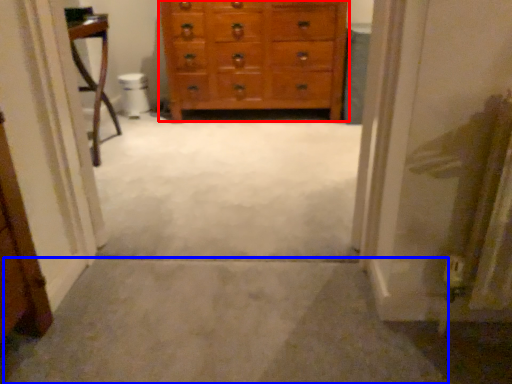
Question: Among these objects, which one is nearest to the camera, chest of drawers (highlighted by a red box) or path (highlighted by a blue box)?

Choices:
 (A) chest of drawers
 (B) path

Answer: (B)